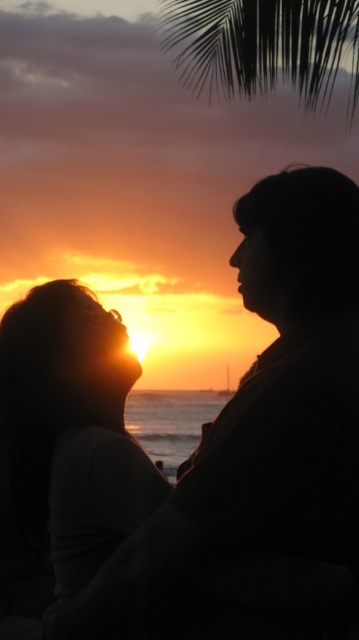
Question: Based on their relative distances, which object is farther from the green leafy palm tree at upper center?

Choices:
 (A) matte black hair at lower left
 (B) silhouette couple at center

Answer: (A)

Question: Where is silhouette couple at center located in relation to green leafy palm tree at upper center in the image?

Choices:
 (A) left
 (B) right

Answer: (A)

Question: Which is farther from the green leafy palm tree at upper center?

Choices:
 (A) silhouette couple at center
 (B) matte black hair at lower left

Answer: (B)

Question: Considering the relative positions of silhouette couple at center and green leafy palm tree at upper center in the image provided, where is silhouette couple at center located with respect to green leafy palm tree at upper center?

Choices:
 (A) left
 (B) right

Answer: (A)

Question: Among these objects, which one is farthest from the camera?

Choices:
 (A) silhouette couple at center
 (B) green leafy palm tree at upper center
 (C) matte black hair at lower left

Answer: (B)

Question: Does matte black hair at lower left have a greater width compared to green leafy palm tree at upper center?

Choices:
 (A) no
 (B) yes

Answer: (A)